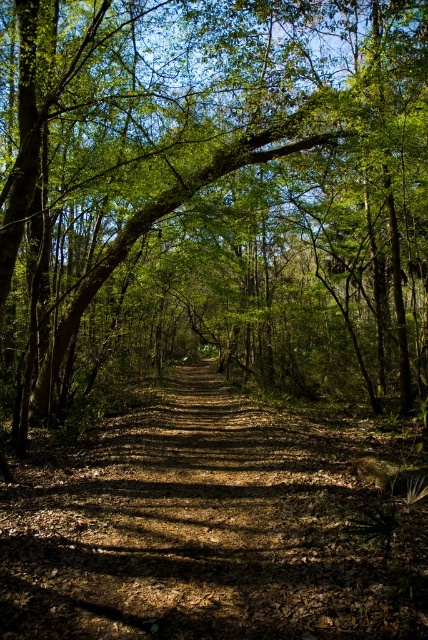
You are standing at the starting point of the forest path and see two points marked on the ground ahead of you. The first point is at coordinate point [339,177] and the second is at point [422,609]. Which point is closer to your current position?

Point [422,609] is closer to your current position because it is in front of point [339,177], which is further back along the path.

You are standing on the brown dirt trail at center and want to walk towards the green leafy tree at center. Is the tree blocking your path?

The brown dirt trail at center is behind green leafy tree at center, so the tree is blocking your path.